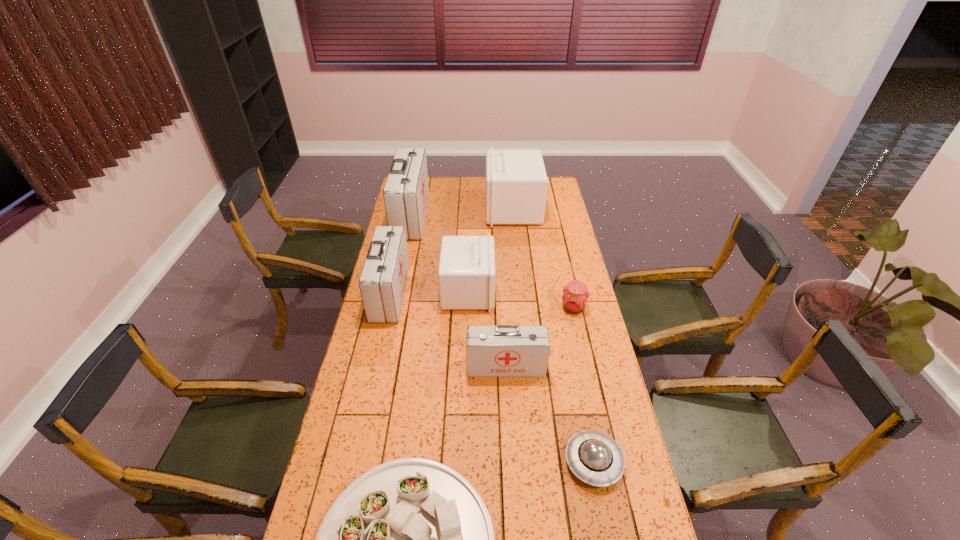
Locate an element on the screen. The image size is (960, 540). the bigger white first-aid kit is located at coordinates (516, 182).

Where is `the biggest red first-aid kit`? the biggest red first-aid kit is located at coordinates (406, 191).

You are a GUI agent. You are given a task and a screenshot of the screen. Output one action in this format:
    pyautogui.click(x=<x>, y=<y>)
    Task: Click on the nearer white first-aid kit
    The image size is (960, 540).
    Given the screenshot: What is the action you would take?
    coord(466,275)

Locate an element on the screen. the second nearest red first-aid kit is located at coordinates (382, 282).

Find the location of a particular element. The height and width of the screenshot is (540, 960). the shortest first-aid kit is located at coordinates (503, 350).

This screenshot has width=960, height=540. I want to click on the smallest red first-aid kit, so click(503, 350).

Where is `red jam`? The width and height of the screenshot is (960, 540). red jam is located at coordinates (574, 300).

Find the location of a particular element. This screenshot has height=540, width=960. the sixth tallest object is located at coordinates (574, 300).

I want to click on gray saucer, so click(594, 457).

I want to click on free space located 0.090m on the front-facing side of the farther white first-aid kit, so click(x=468, y=209).